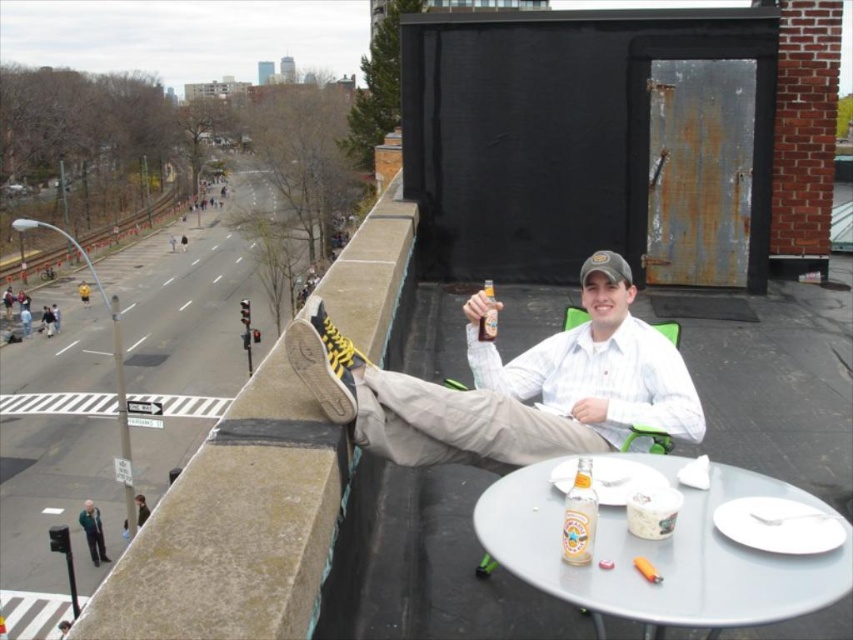
Question: Can you confirm if matte white shirt at center is positioned to the left of translucent glass bottle at table center?

Choices:
 (A) yes
 (B) no

Answer: (A)

Question: Among these objects, which one is nearest to the camera?

Choices:
 (A) metallic gray table at center
 (B) brown concrete ledge at upper left
 (C) green fabric jacket at lower left

Answer: (B)

Question: Can you confirm if matte white shirt at center is wider than translucent glass bottle at table center?

Choices:
 (A) yes
 (B) no

Answer: (A)

Question: Does translucent glass bottle at table center have a lesser width compared to green fabric jacket at lower left?

Choices:
 (A) no
 (B) yes

Answer: (B)

Question: Which object appears farthest from the camera in this image?

Choices:
 (A) matte white shirt at center
 (B) translucent glass bottle at table center

Answer: (A)

Question: Which of the following is the farthest from the observer?

Choices:
 (A) (734, 621)
 (B) (577, 419)
 (C) (177, 552)

Answer: (B)